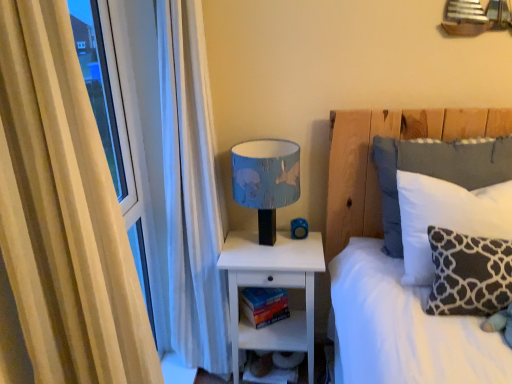
Question: From the image's perspective, is white soft pillow at upper right, which is the first pillow in back-to-front order, located beneath dark gray velvety pillow at right, which is counted as the first pillow, starting from the front?

Choices:
 (A) no
 (B) yes

Answer: (A)

Question: Can you confirm if white soft pillow at upper right, which is the first pillow in back-to-front order, is wider than dark gray velvety pillow at right, arranged as the 3th pillow when viewed from the back?

Choices:
 (A) no
 (B) yes

Answer: (B)

Question: Is white soft pillow at upper right, which is the first pillow in back-to-front order, positioned far away from dark gray velvety pillow at right, arranged as the 3th pillow when viewed from the back?

Choices:
 (A) no
 (B) yes

Answer: (A)

Question: Does white soft pillow at upper right, which is the first pillow in back-to-front order, appear on the left side of dark gray velvety pillow at right, arranged as the 3th pillow when viewed from the back?

Choices:
 (A) no
 (B) yes

Answer: (A)

Question: Does white soft pillow at upper right, which is the first pillow in back-to-front order, have a greater height compared to dark gray velvety pillow at right, arranged as the 3th pillow when viewed from the back?

Choices:
 (A) yes
 (B) no

Answer: (A)

Question: In the image, is dark gray fabric pillow at right, which is the 2th pillow from back to front, on the left side or the right side of hardcover book at lower center?

Choices:
 (A) right
 (B) left

Answer: (A)

Question: Is point (483, 225) closer or farther from the camera than point (251, 312)?

Choices:
 (A) closer
 (B) farther

Answer: (A)

Question: Is dark gray fabric pillow at right, which is the 2th pillow from back to front, in front of or behind hardcover book at lower center in the image?

Choices:
 (A) front
 (B) behind

Answer: (A)

Question: From the image's perspective, is dark gray fabric pillow at right, the 2th pillow positioned from the front, located above or below hardcover book at lower center?

Choices:
 (A) above
 (B) below

Answer: (A)

Question: Considering the relative positions of beige fabric curtain at left and dark gray velvety pillow at right, which is counted as the first pillow, starting from the front, in the image provided, is beige fabric curtain at left to the left or to the right of dark gray velvety pillow at right, which is counted as the first pillow, starting from the front,?

Choices:
 (A) left
 (B) right

Answer: (A)

Question: From their relative heights in the image, would you say beige fabric curtain at left is taller or shorter than dark gray velvety pillow at right, arranged as the 3th pillow when viewed from the back?

Choices:
 (A) short
 (B) tall

Answer: (B)

Question: Considering their positions, is beige fabric curtain at left located in front of or behind dark gray velvety pillow at right, which is counted as the first pillow, starting from the front?

Choices:
 (A) front
 (B) behind

Answer: (A)

Question: From a real-world perspective, relative to dark gray velvety pillow at right, which is counted as the first pillow, starting from the front, is beige fabric curtain at left vertically above or below?

Choices:
 (A) above
 (B) below

Answer: (A)

Question: Choose the correct answer: Is white soft pillow at upper right, which appears as the third pillow when viewed from the front, inside dark gray velvety pillow at right, arranged as the 3th pillow when viewed from the back, or outside it?

Choices:
 (A) inside
 (B) outside

Answer: (B)

Question: Is white soft pillow at upper right, which is the first pillow in back-to-front order, wider or thinner than dark gray velvety pillow at right, which is counted as the first pillow, starting from the front?

Choices:
 (A) wide
 (B) thin

Answer: (A)